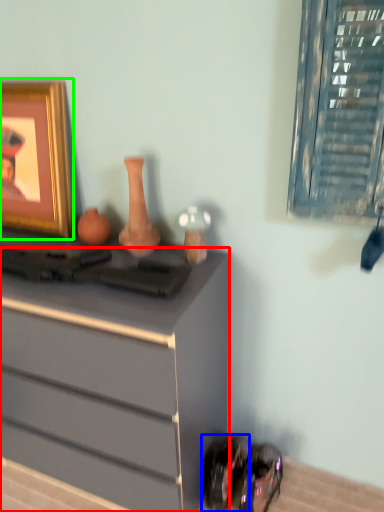
Question: Based on their relative distances, which object is farther from chest of drawers (highlighted by a red box)? Choose from shoe (highlighted by a blue box) and picture frame (highlighted by a green box).

Choices:
 (A) shoe
 (B) picture frame

Answer: (B)